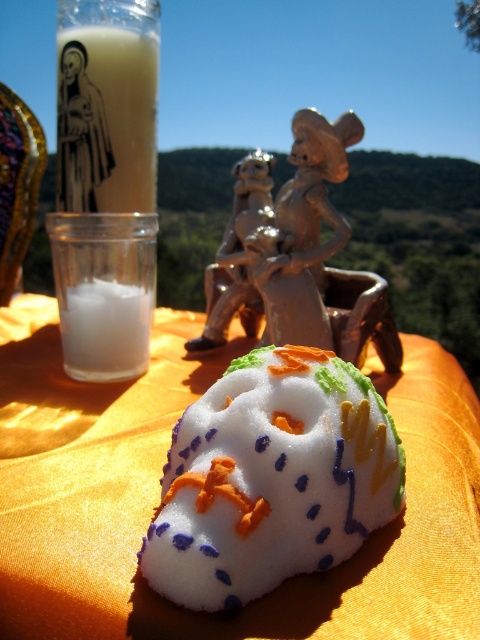
Question: Where is orange satin tablecloth at lower center located in relation to white opaque liquid at left in the image?

Choices:
 (A) below
 (B) above

Answer: (A)

Question: Does white sugar skull at center have a lesser width compared to brown matte figurine at center?

Choices:
 (A) yes
 (B) no

Answer: (A)

Question: Is orange satin tablecloth at lower center to the right of brown matte figurine at center from the viewer's perspective?

Choices:
 (A) no
 (B) yes

Answer: (A)

Question: Which object appears closest to the camera in this image?

Choices:
 (A) orange satin tablecloth at lower center
 (B) white sugar skull at center

Answer: (A)

Question: Which object appears farthest from the camera in this image?

Choices:
 (A) orange satin tablecloth at lower center
 (B) white sugar skull at center
 (C) brown matte figurine at center
 (D) white opaque liquid at left

Answer: (D)

Question: Among these points, which one is farthest from the camera?

Choices:
 (A) (137, 365)
 (B) (239, 472)
 (C) (94, 570)
 (D) (330, 212)

Answer: (D)